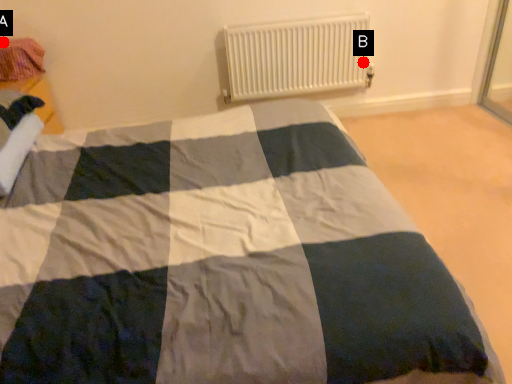
Question: Two points are circled on the image, labeled by A and B beside each circle. Which of the following is the farthest from the observer?

Choices:
 (A) A is further
 (B) B is further

Answer: (B)